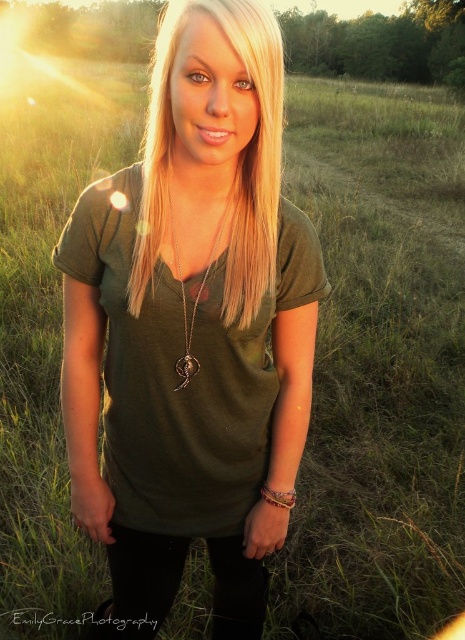
In the scene shown: You are a photographer trying to capture the perfect shot of the person in the sunset. You notice the blonde silky hair at center and the silver metallic pendant at center. Which object is positioned higher on the person?

The blonde silky hair at center is located above the silver metallic pendant at center, so the blonde silky hair at center is positioned higher on the person.